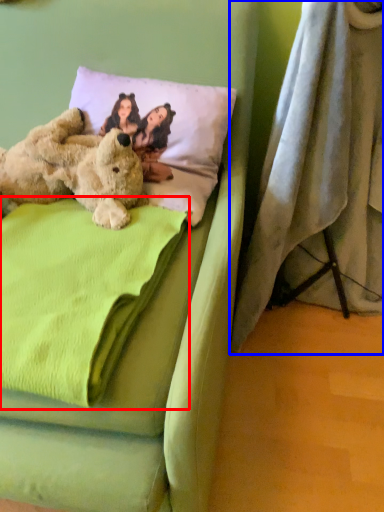
Question: Among these objects, which one is nearest to the camera, blanket (highlighted by a red box) or curtain (highlighted by a blue box)?

Choices:
 (A) blanket
 (B) curtain

Answer: (A)